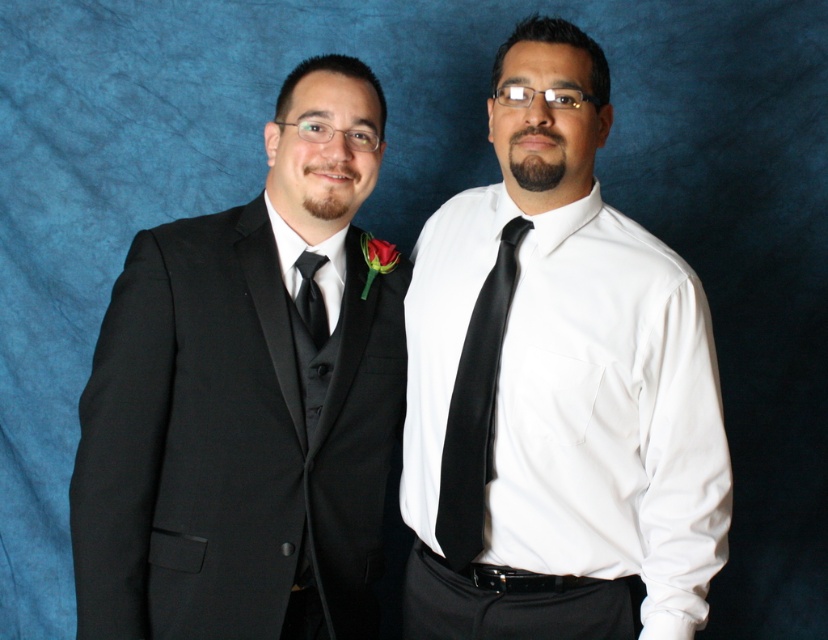
Who is more forward, (x=686, y=541) or (x=302, y=282)?

Point (x=686, y=541) is in front.

Does white satin shirt at center lie behind black satin tie at left?

No, white satin shirt at center is in front of black satin tie at left.

Consider the image. Who is more forward, (x=639, y=280) or (x=304, y=278)?

Point (x=639, y=280) is in front.

At what (x,y) coordinates should I click in order to perform the action: click on white satin shirt at center. Please return your answer as a coordinate pair (x, y). The image size is (828, 640). Looking at the image, I should click on (556, 385).

Between matte black suit at left and black satin tie at left, which one has more height?

matte black suit at left

Does matte black suit at left have a lesser height compared to black satin tie at left?

No, matte black suit at left is not shorter than black satin tie at left.

Does point (292, 172) come farther from viewer compared to point (302, 259)?

No, (292, 172) is in front of (302, 259).

This screenshot has width=828, height=640. Find the location of `matte black suit at left`. matte black suit at left is located at coordinates (248, 400).

In the scene shown: Can you confirm if white satin shirt at center is taller than matte black suit at left?

Indeed, white satin shirt at center has a greater height compared to matte black suit at left.

Is point (542, 145) less distant than point (352, 472)?

That is True.

Image resolution: width=828 pixels, height=640 pixels. Identify the location of white satin shirt at center. [556, 385].